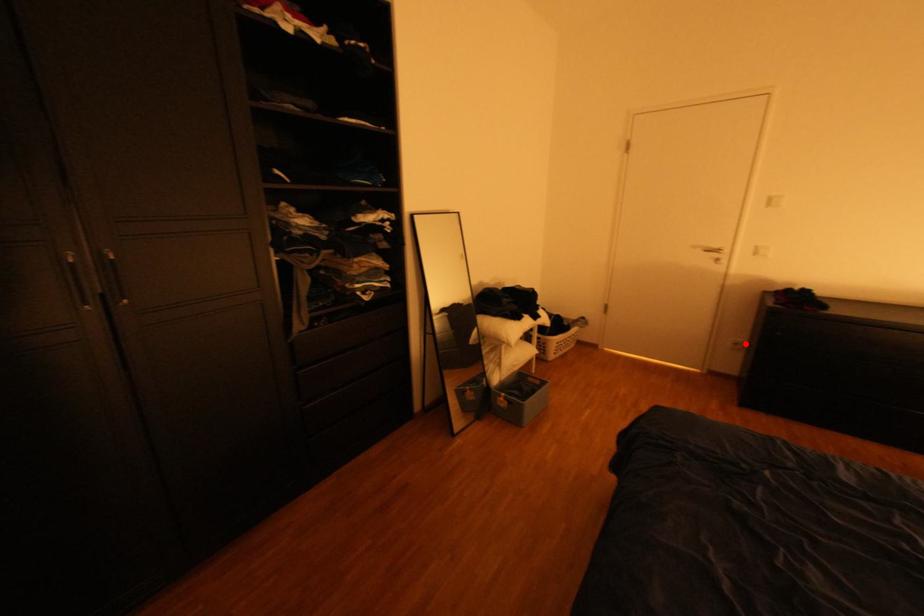
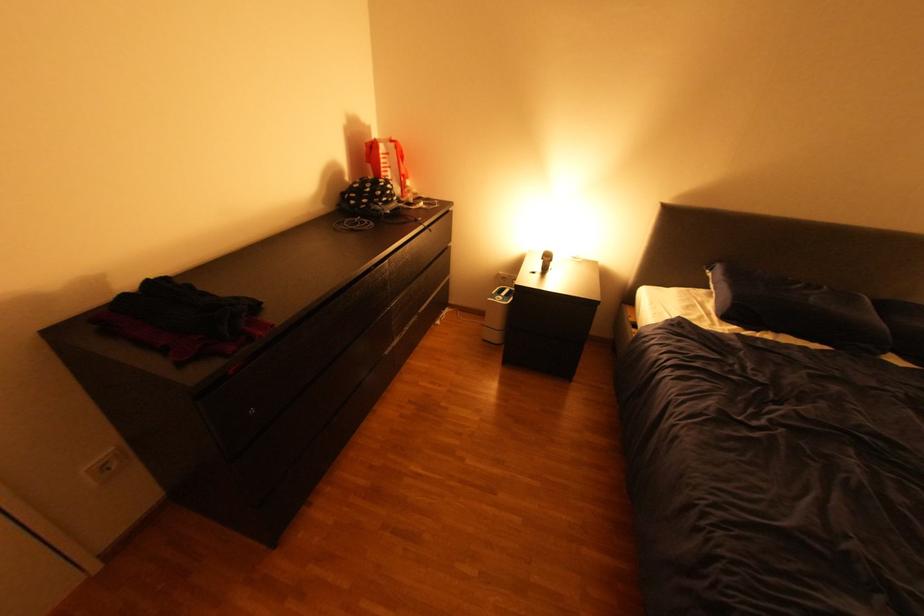
Locate, in the second image, the point that corresponds to the highlighted location in the first image.

(114, 467)